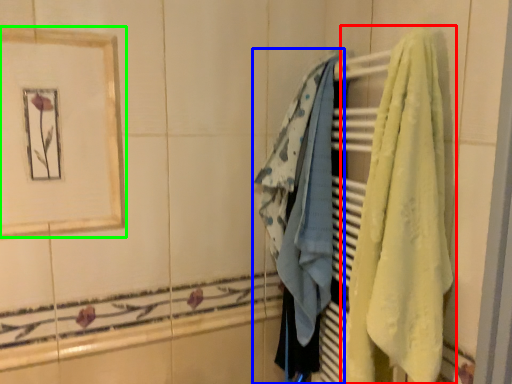
Question: Considering the real-world distances, which object is farthest from towel (highlighted by a red box)? towel (highlighted by a blue box) or picture frame (highlighted by a green box)?

Choices:
 (A) towel
 (B) picture frame

Answer: (B)